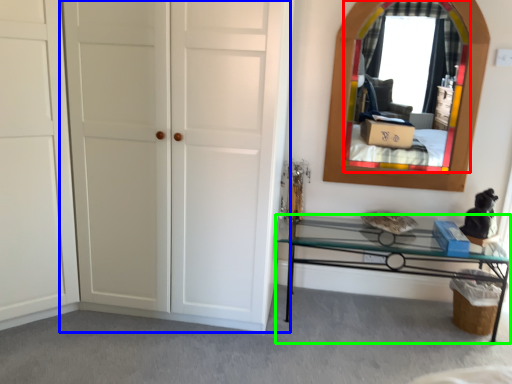
Question: Which object is the farthest from mirror (highlighted by a red box)? Choose among these: door (highlighted by a blue box) or table (highlighted by a green box).

Choices:
 (A) door
 (B) table

Answer: (A)